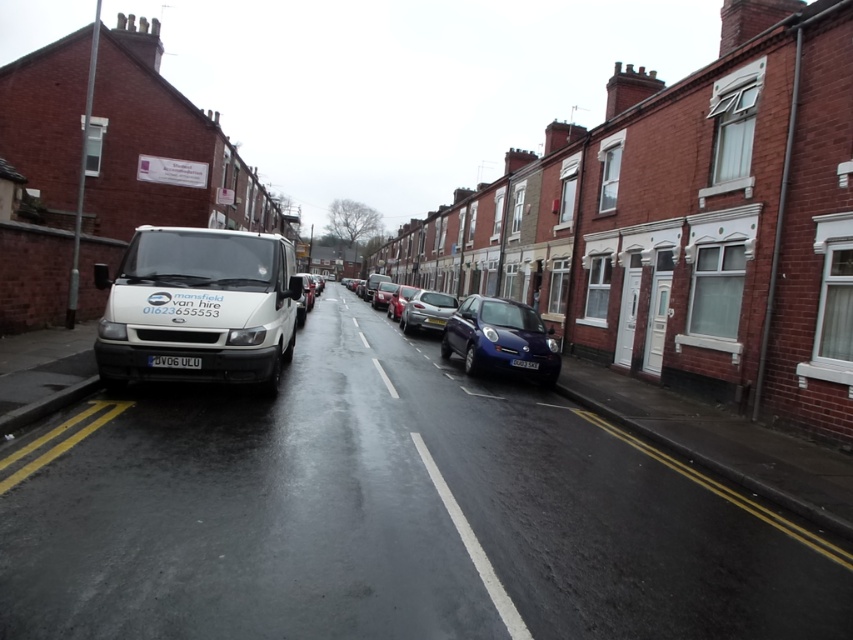
Does white matte van at center come behind metallic silver hatchback at center?

No, white matte van at center is in front of metallic silver hatchback at center.

In the scene shown: Does white matte van at center appear on the right side of metallic silver hatchback at center?

No, white matte van at center is not to the right of metallic silver hatchback at center.

Describe the element at coordinates (198, 307) in the screenshot. The width and height of the screenshot is (853, 640). I see `white matte van at center` at that location.

Locate an element on the screen. white matte van at center is located at coordinates (198, 307).

Is white asphalt line at center to the right of metallic silver car at center from the viewer's perspective?

Yes, white asphalt line at center is to the right of metallic silver car at center.

Based on the photo, is white asphalt line at center further to the viewer compared to metallic silver car at center?

No.

The width and height of the screenshot is (853, 640). I want to click on white asphalt line at center, so click(473, 547).

Locate an element on the screen. Image resolution: width=853 pixels, height=640 pixels. white asphalt line at center is located at coordinates (473, 547).

Can you confirm if yellow painted line at lower left is thinner than shiny metallic car at center?

Indeed, yellow painted line at lower left has a lesser width compared to shiny metallic car at center.

Who is more forward, (0, 493) or (386, 296)?

Point (0, 493) is more forward.

Locate an element on the screen. This screenshot has height=640, width=853. yellow painted line at lower left is located at coordinates (56, 440).

Locate an element on the screen. Image resolution: width=853 pixels, height=640 pixels. yellow painted line at lower left is located at coordinates (56, 440).